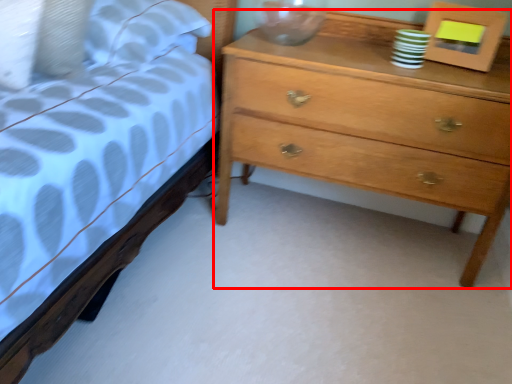
Question: Considering the relative positions of chest of drawers (annotated by the red box) and picture frame in the image provided, where is chest of drawers (annotated by the red box) located with respect to the staircase?

Choices:
 (A) right
 (B) left

Answer: (B)